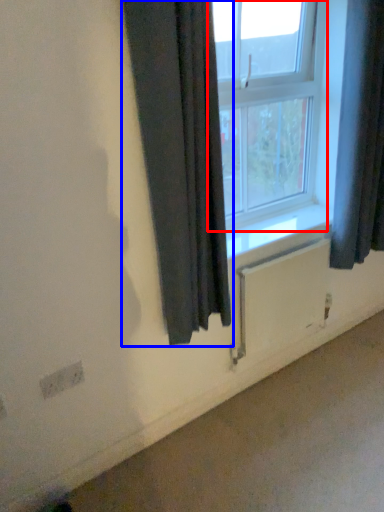
Question: Which object appears closest to the camera in this image, window (highlighted by a red box) or curtain (highlighted by a blue box)?

Choices:
 (A) window
 (B) curtain

Answer: (B)